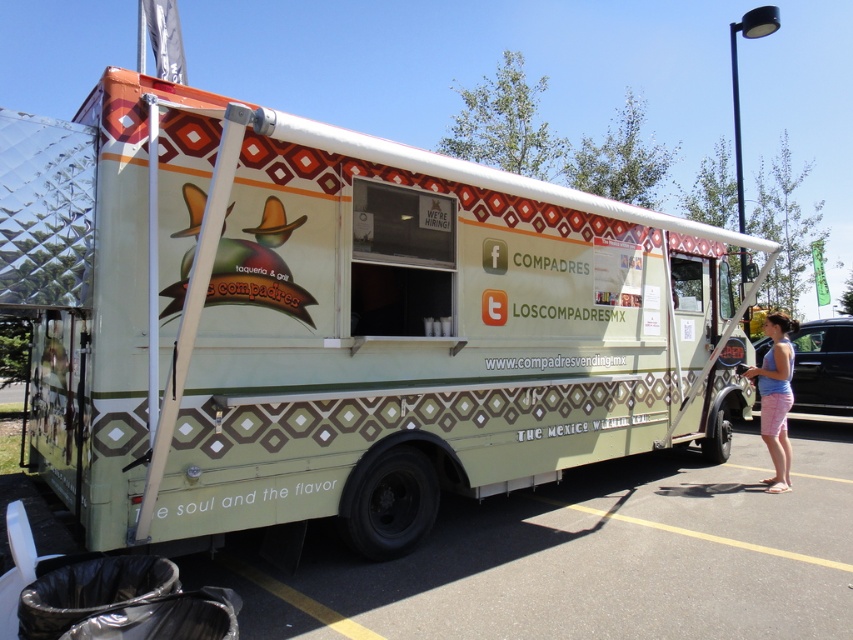
Measure the distance from matte green food truck at center to pink cotton shorts at lower right.

A distance of 21.36 feet exists between matte green food truck at center and pink cotton shorts at lower right.

Where is `matte green food truck at center`? This screenshot has height=640, width=853. matte green food truck at center is located at coordinates (335, 323).

Can you confirm if green asphalt at lower center is positioned below pink cotton shorts at lower right?

Yes.

Is point (448, 604) farther from camera compared to point (782, 385)?

No, (448, 604) is closer to viewer.

Based on the photo, who is more forward, (x=281, y=570) or (x=769, y=477)?

Point (x=281, y=570) is in front.

Image resolution: width=853 pixels, height=640 pixels. I want to click on green asphalt at lower center, so click(x=589, y=556).

Is matte green food truck at center shorter than green asphalt at lower center?

Incorrect, matte green food truck at center's height does not fall short of green asphalt at lower center's.

The width and height of the screenshot is (853, 640). What are the coordinates of `matte green food truck at center` in the screenshot? It's located at (335, 323).